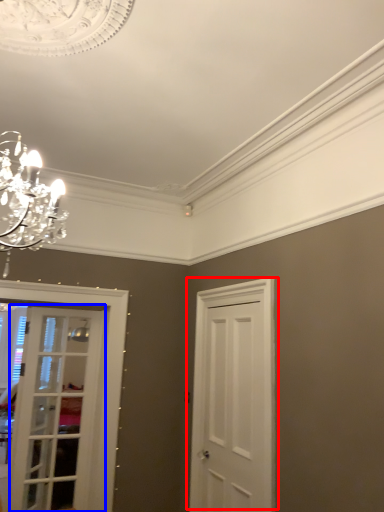
Question: Which object is further to the camera taking this photo, door (highlighted by a red box) or door (highlighted by a blue box)?

Choices:
 (A) door
 (B) door

Answer: (B)